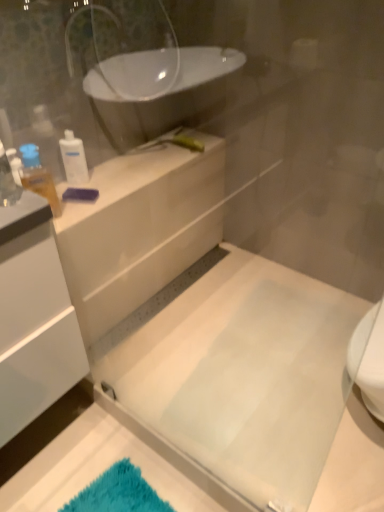
Question: Can you see white plastic bottle at upper left, which is the 1th toiletry in back-to-front order, touching white glossy counter at upper left?

Choices:
 (A) no
 (B) yes

Answer: (A)

Question: Does white plastic bottle at upper left, positioned as the 2th toiletry in front-to-back order, have a lesser width compared to white glossy counter at upper left?

Choices:
 (A) no
 (B) yes

Answer: (B)

Question: Can you confirm if white plastic bottle at upper left, positioned as the 2th toiletry in front-to-back order, is smaller than white glossy counter at upper left?

Choices:
 (A) yes
 (B) no

Answer: (A)

Question: From the image's perspective, does white plastic bottle at upper left, which is the 1th toiletry in back-to-front order, appear higher than white glossy counter at upper left?

Choices:
 (A) yes
 (B) no

Answer: (A)

Question: Can you confirm if white plastic bottle at upper left, positioned as the 2th toiletry in front-to-back order, is positioned to the right of white glossy counter at upper left?

Choices:
 (A) yes
 (B) no

Answer: (B)

Question: Does white plastic bottle at upper left, positioned as the 2th toiletry in front-to-back order, lie in front of white glossy counter at upper left?

Choices:
 (A) yes
 (B) no

Answer: (B)

Question: From the image's perspective, is white glossy counter at upper left above white plastic bottle at upper left, positioned as the 2th toiletry in front-to-back order?

Choices:
 (A) no
 (B) yes

Answer: (A)

Question: Considering the relative sizes of white glossy counter at upper left and white plastic bottle at upper left, which is the 1th toiletry in back-to-front order, in the image provided, is white glossy counter at upper left shorter than white plastic bottle at upper left, which is the 1th toiletry in back-to-front order,?

Choices:
 (A) yes
 (B) no

Answer: (A)

Question: Is white glossy counter at upper left outside of white plastic bottle at upper left, positioned as the 2th toiletry in front-to-back order?

Choices:
 (A) yes
 (B) no

Answer: (A)

Question: Would you consider white glossy counter at upper left to be distant from white plastic bottle at upper left, which is the 1th toiletry in back-to-front order?

Choices:
 (A) yes
 (B) no

Answer: (B)

Question: Are white glossy counter at upper left and white plastic bottle at upper left, which is the 1th toiletry in back-to-front order, making contact?

Choices:
 (A) yes
 (B) no

Answer: (B)

Question: From a real-world perspective, does white glossy counter at upper left sit lower than white plastic bottle at upper left, which is the 1th toiletry in back-to-front order?

Choices:
 (A) no
 (B) yes

Answer: (B)

Question: Can you confirm if translucent plastic bottle at upper left, which is counted as the second toiletry, starting from the back, is positioned to the left of white plastic bottle at upper left, which is the 1th toiletry in back-to-front order?

Choices:
 (A) yes
 (B) no

Answer: (A)